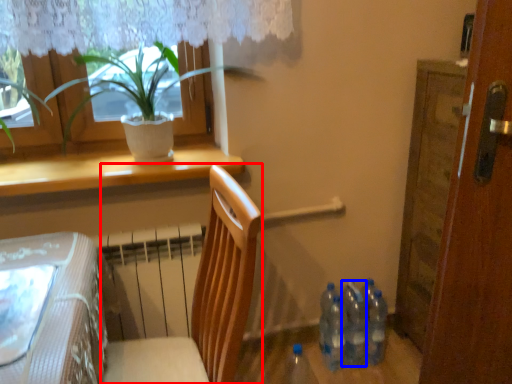
Question: Which object appears farthest to the camera in this image, chair (highlighted by a red box) or bottle (highlighted by a blue box)?

Choices:
 (A) chair
 (B) bottle

Answer: (B)